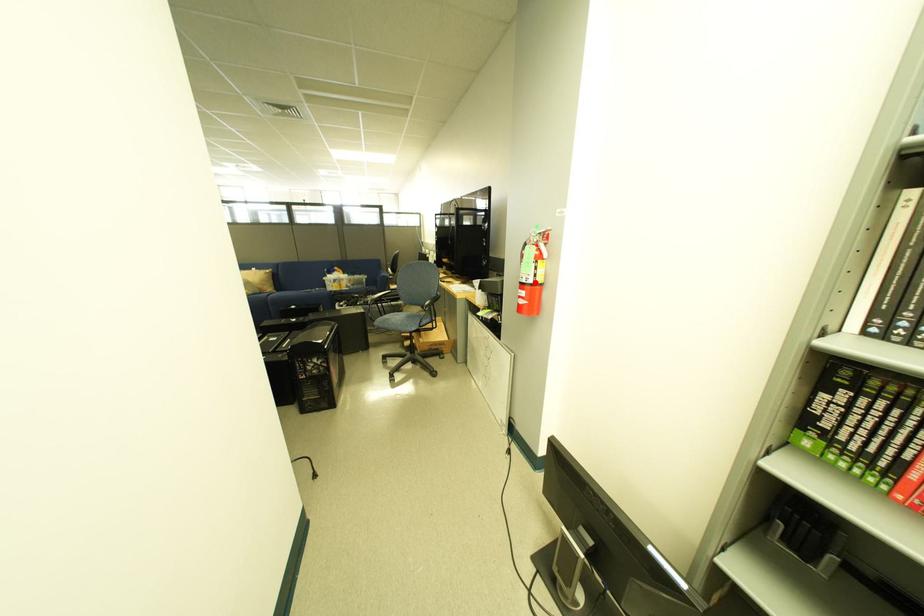
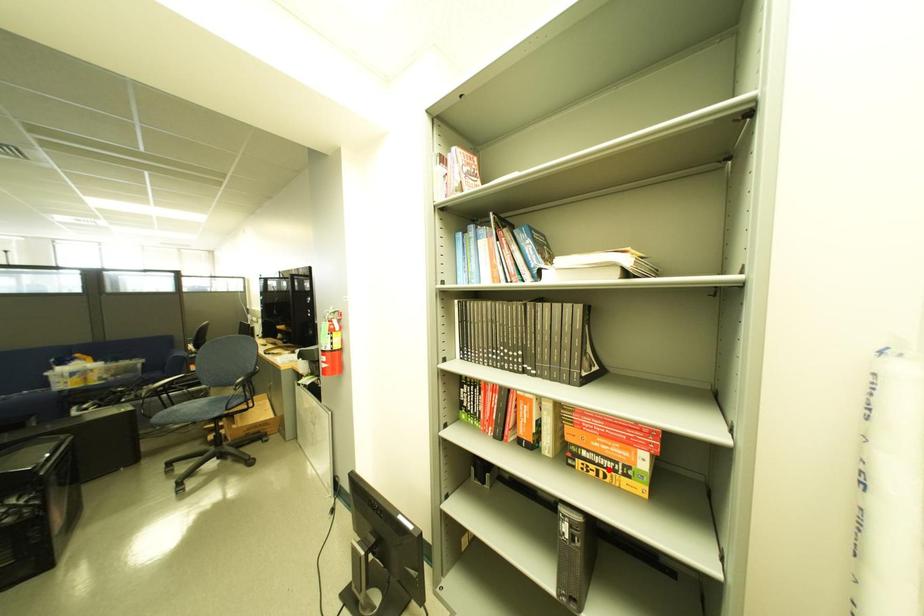
I am providing you with two images of the same scene from different viewpoints. A red point is marked on the first image and another point is marked on the second image. Does the point marked in image1 correspond to the same location as the one in image2?

No